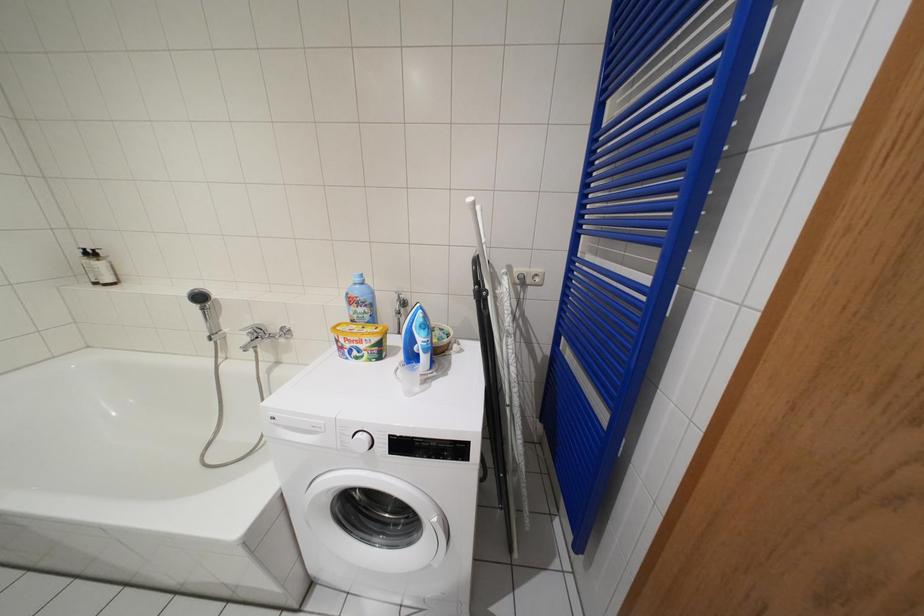
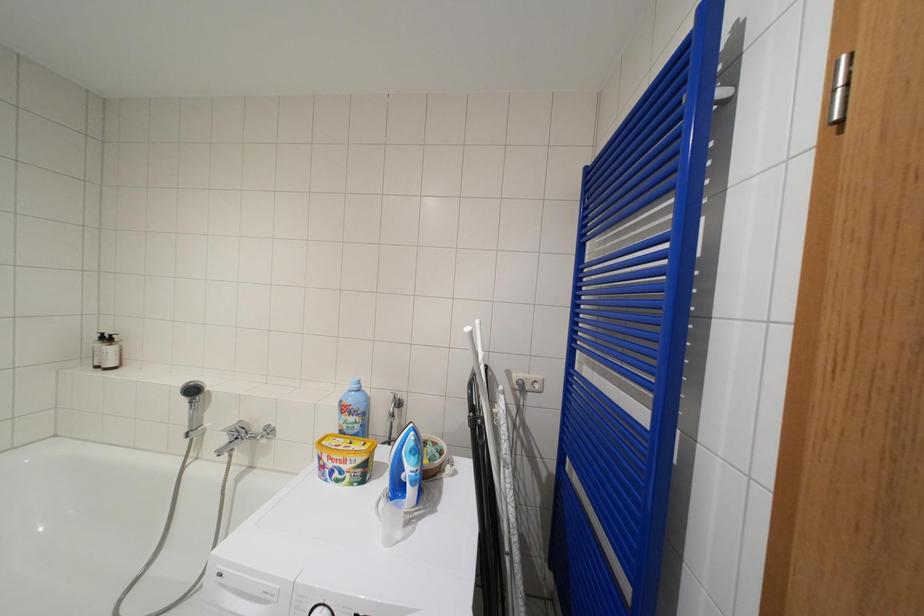
Question: How did the camera likely rotate?

Choices:
 (A) Left
 (B) Right
 (C) Up
 (D) Down

Answer: (C)